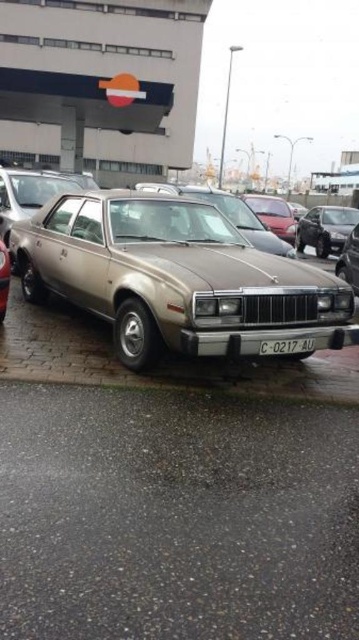
Question: Which object appears farthest from the camera in this image?

Choices:
 (A) white plastic license plate at center
 (B) metallic gold car at center

Answer: (A)

Question: Considering the real-world distances, which object is closest to the gold metallic sedan at center?

Choices:
 (A) white plastic license plate at center
 (B) metallic gold car at center

Answer: (B)

Question: Can you confirm if metallic gold car at center is wider than white plastic license plate at center?

Choices:
 (A) yes
 (B) no

Answer: (A)

Question: Does gold metallic sedan at center appear over white plastic license plate at center?

Choices:
 (A) yes
 (B) no

Answer: (A)

Question: Which of the following is the closest to the observer?

Choices:
 (A) white plastic license plate at center
 (B) gold metallic sedan at center

Answer: (B)

Question: Observing the image, what is the correct spatial positioning of metallic gold car at center in reference to white plastic license plate at center?

Choices:
 (A) below
 (B) above

Answer: (B)